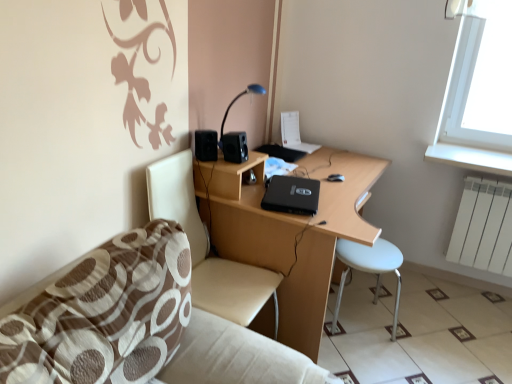
Question: Is white glossy tile at lower right not inside blue glossy table lamp at upper center?

Choices:
 (A) no
 (B) yes

Answer: (B)

Question: Can you confirm if white glossy tile at lower right is taller than blue glossy table lamp at upper center?

Choices:
 (A) no
 (B) yes

Answer: (A)

Question: From a real-world perspective, is white glossy tile at lower right located higher than blue glossy table lamp at upper center?

Choices:
 (A) no
 (B) yes

Answer: (A)

Question: Is white glossy tile at lower right closer to the viewer compared to blue glossy table lamp at upper center?

Choices:
 (A) no
 (B) yes

Answer: (B)

Question: Is white glossy tile at lower right behind blue glossy table lamp at upper center?

Choices:
 (A) no
 (B) yes

Answer: (A)

Question: Is black matte speaker at upper left, the second speaker positioned from the right, taller or shorter than black matte laptop at center?

Choices:
 (A) short
 (B) tall

Answer: (B)

Question: From the image's perspective, is black matte speaker at upper left, the second speaker positioned from the right, located above or below black matte laptop at center?

Choices:
 (A) above
 (B) below

Answer: (A)

Question: From a real-world perspective, is black matte speaker at upper left, arranged as the first speaker when viewed from the left, positioned above or below black matte laptop at center?

Choices:
 (A) below
 (B) above

Answer: (B)

Question: In terms of size, does black matte speaker at upper left, the second speaker positioned from the right, appear bigger or smaller than black matte laptop at center?

Choices:
 (A) small
 (B) big

Answer: (A)

Question: Is black matte desk at center bigger or smaller than black plastic speaker at upper center, acting as the 1th speaker starting from the right?

Choices:
 (A) big
 (B) small

Answer: (A)

Question: Is black matte desk at center taller or shorter than black plastic speaker at upper center, acting as the 1th speaker starting from the right?

Choices:
 (A) tall
 (B) short

Answer: (A)

Question: From the image's perspective, is black matte desk at center located above or below black plastic speaker at upper center, the 2th speaker positioned from the left?

Choices:
 (A) above
 (B) below

Answer: (B)

Question: Considering the positions of point (350, 203) and point (228, 158), is point (350, 203) closer or farther from the camera than point (228, 158)?

Choices:
 (A) closer
 (B) farther

Answer: (B)

Question: Is black plastic speaker at upper center, acting as the 1th speaker starting from the right, bigger or smaller than black matte speaker at upper left, arranged as the first speaker when viewed from the left?

Choices:
 (A) big
 (B) small

Answer: (B)

Question: Is point pos(237,144) closer or farther from the camera than point pos(208,137)?

Choices:
 (A) closer
 (B) farther

Answer: (B)